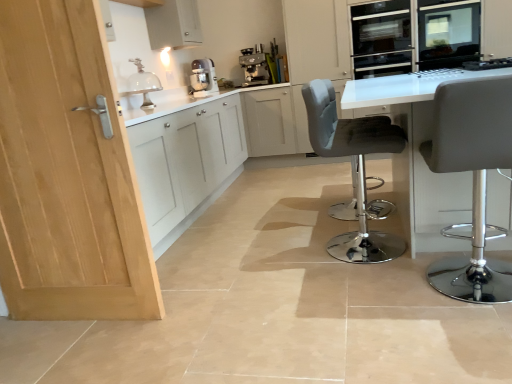
What do you see at coordinates (254, 66) in the screenshot?
I see `metallic silver coffee machine at upper center` at bounding box center [254, 66].

This screenshot has width=512, height=384. What do you see at coordinates (473, 179) in the screenshot?
I see `matte gray stool at right, which is the 1th chair in front-to-back order` at bounding box center [473, 179].

This screenshot has width=512, height=384. Identify the location of light wood door at left. (67, 173).

Image resolution: width=512 pixels, height=384 pixels. What are the coordinates of `kitchen appliance directly beneath the white matte cabinet at upper left (from a real-world perspective)` in the screenshot? It's located at (203, 78).

What's the angular difference between white matte cabinet at upper left and matte white mixer at upper center's facing directions?

A: There is a 21-degree angle between the facing directions of white matte cabinet at upper left and matte white mixer at upper center.

Considering the relative sizes of white matte cabinet at upper left and matte white mixer at upper center in the image provided, is white matte cabinet at upper left bigger than matte white mixer at upper center?

Correct, white matte cabinet at upper left is larger in size than matte white mixer at upper center.

From a real-world perspective, is matte gray stool at right, the 2th chair when ordered from back to front, positioned above or below black glass oven at upper right?

matte gray stool at right, the 2th chair when ordered from back to front, is situated lower than black glass oven at upper right in the real world.

Is matte gray stool at right, the 2th chair when ordered from back to front, positioned far away from black glass oven at upper right?

Yes, matte gray stool at right, the 2th chair when ordered from back to front, and black glass oven at upper right are located far from each other.

Is matte gray stool at right, which is the 1th chair in front-to-back order, thinner than black glass oven at upper right?

No.

Which of these two, matte gray stool at right, which is the 1th chair in front-to-back order, or black glass oven at upper right, stands taller?

matte gray stool at right, which is the 1th chair in front-to-back order.

What's the angular difference between white glossy table at center and satin silver oven at upper right's facing directions?

The angle between the facing direction of white glossy table at center and the facing direction of satin silver oven at upper right is 179 degrees.

Which object is thinner, white glossy table at center or satin silver oven at upper right?

satin silver oven at upper right.

Would you say white glossy table at center contains satin silver oven at upper right?

No.

Which is behind, white glossy table at center or satin silver oven at upper right?

satin silver oven at upper right is further from the camera.

Which point is more distant from viewer, (357, 90) or (452, 273)?

The point (357, 90) is behind.

Looking at this image, is white glossy table at center not close to matte gray stool at right, which is the 1th chair in front-to-back order?

No, white glossy table at center is not far from matte gray stool at right, which is the 1th chair in front-to-back order.

Is white glossy table at center closer to the viewer compared to matte gray stool at right, which is the 1th chair in front-to-back order?

No, white glossy table at center is further to the viewer.

Looking at this image, from the image's perspective, is white glossy table at center above matte gray stool at right, which is the 1th chair in front-to-back order?

Yes, from the image's perspective, white glossy table at center is on top of matte gray stool at right, which is the 1th chair in front-to-back order.

Considering the positions of objects black glass oven at upper right and clear glass dome at upper center in the image provided, who is more to the right, black glass oven at upper right or clear glass dome at upper center?

black glass oven at upper right is more to the right.

Is black glass oven at upper right oriented away from clear glass dome at upper center?

No, clear glass dome at upper center is not at the back of black glass oven at upper right.

Choose the correct answer: Is black glass oven at upper right inside clear glass dome at upper center or outside it?

black glass oven at upper right exists outside the volume of clear glass dome at upper center.

How different are the orientations of velvet grey bar stool at center, marked as the first chair in a back-to-front arrangement, and white glossy table at center in degrees?

There is a 92.2-degree angle between the facing directions of velvet grey bar stool at center, marked as the first chair in a back-to-front arrangement, and white glossy table at center.

Consider the image. From the image's perspective, between velvet grey bar stool at center, which is counted as the 2th chair, starting from the front, and white glossy table at center, who is located below?

velvet grey bar stool at center, which is counted as the 2th chair, starting from the front.

Considering the relative sizes of velvet grey bar stool at center, which is counted as the 2th chair, starting from the front, and white glossy table at center in the image provided, is velvet grey bar stool at center, which is counted as the 2th chair, starting from the front, wider than white glossy table at center?

In fact, velvet grey bar stool at center, which is counted as the 2th chair, starting from the front, might be narrower than white glossy table at center.

Is velvet grey bar stool at center, which is counted as the 2th chair, starting from the front, to the left of white glossy table at center from the viewer's perspective?

Answer: Yes.

Measure the distance from metallic silver coffee machine at upper center to clear glass dome at upper center.

metallic silver coffee machine at upper center and clear glass dome at upper center are 4.33 feet apart.

From the image's perspective, does metallic silver coffee machine at upper center appear lower than clear glass dome at upper center?

Actually, metallic silver coffee machine at upper center appears above clear glass dome at upper center in the image.

Is metallic silver coffee machine at upper center oriented away from clear glass dome at upper center?

metallic silver coffee machine at upper center does not have its back to clear glass dome at upper center.

Does metallic silver coffee machine at upper center have a larger size compared to clear glass dome at upper center?

Yes, metallic silver coffee machine at upper center is bigger than clear glass dome at upper center.

This screenshot has width=512, height=384. I want to click on cabinetry that is above the matte white mixer at upper center (from a real-world perspective), so click(174, 25).

Identify the location of appliance behind the matte gray stool at right, which is the 1th chair in front-to-back order. (448, 33).

From the image, which object appears to be nearer to matte gray stool at right, the 2th chair when ordered from back to front, metallic silver coffee machine at upper center or satin silver oven at upper right?

Among the two, satin silver oven at upper right is located nearer to matte gray stool at right, the 2th chair when ordered from back to front.

Looking at the image, which one is located closer to matte gray stool at right, which is the 1th chair in front-to-back order, matte white mixer at upper center or velvet grey bar stool at center, marked as the first chair in a back-to-front arrangement?

velvet grey bar stool at center, marked as the first chair in a back-to-front arrangement, is closer to matte gray stool at right, which is the 1th chair in front-to-back order.

From the picture: Considering their positions, is clear glass dome at upper center positioned closer to white matte cabinet at upper left than matte white mixer at upper center?

clear glass dome at upper center.

Estimate the real-world distances between objects in this image. Which object is closer to light wood door at left, black glass oven at upper right or matte white mixer at upper center?

Among the two, matte white mixer at upper center is located nearer to light wood door at left.

When comparing their distances from metallic silver coffee machine at upper center, does clear glass dome at upper center or black glass oven at upper right seem further?

The object further to metallic silver coffee machine at upper center is black glass oven at upper right.

In the scene shown: Looking at the image, which one is located closer to light wood door at left, velvet grey bar stool at center, marked as the first chair in a back-to-front arrangement, or metallic silver coffee machine at upper center?

Based on the image, velvet grey bar stool at center, marked as the first chair in a back-to-front arrangement, appears to be nearer to light wood door at left.

Estimate the real-world distances between objects in this image. Which object is further from velvet grey bar stool at center, marked as the first chair in a back-to-front arrangement, white matte cabinet at upper left or matte white mixer at upper center?

→ Among the two, matte white mixer at upper center is located further to velvet grey bar stool at center, marked as the first chair in a back-to-front arrangement.

Based on their spatial positions, is light wood door at left or white glossy table at center further from metallic silver coffee machine at upper center?

light wood door at left is positioned further to the anchor metallic silver coffee machine at upper center.

Where is `chair between white glossy table at center and matte white mixer at upper center in the front-back direction`? The height and width of the screenshot is (384, 512). chair between white glossy table at center and matte white mixer at upper center in the front-back direction is located at coordinates (357, 170).

Find the location of a particular element. This screenshot has width=512, height=384. chair between matte gray stool at right, which is the 1th chair in front-to-back order, and black glass oven at upper right in the front-back direction is located at coordinates (357, 170).

Find the location of a particular element. Image resolution: width=512 pixels, height=384 pixels. table between matte gray stool at right, which is the 1th chair in front-to-back order, and white matte cabinet at upper left, along the z-axis is located at coordinates (418, 154).

Locate an element on the screen. This screenshot has width=512, height=384. cabinetry positioned between white glossy table at center and metallic silver coffee machine at upper center from near to far is located at coordinates (174, 25).